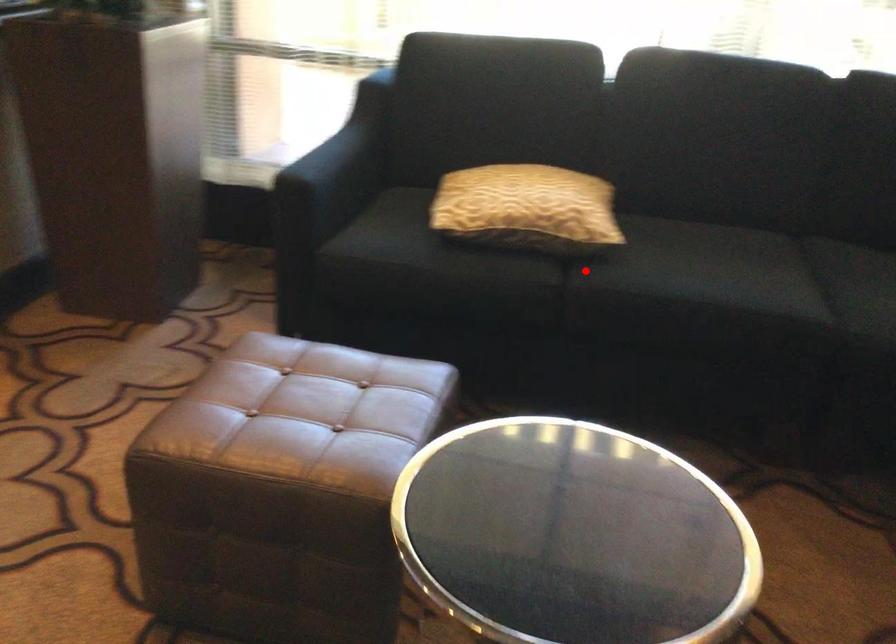
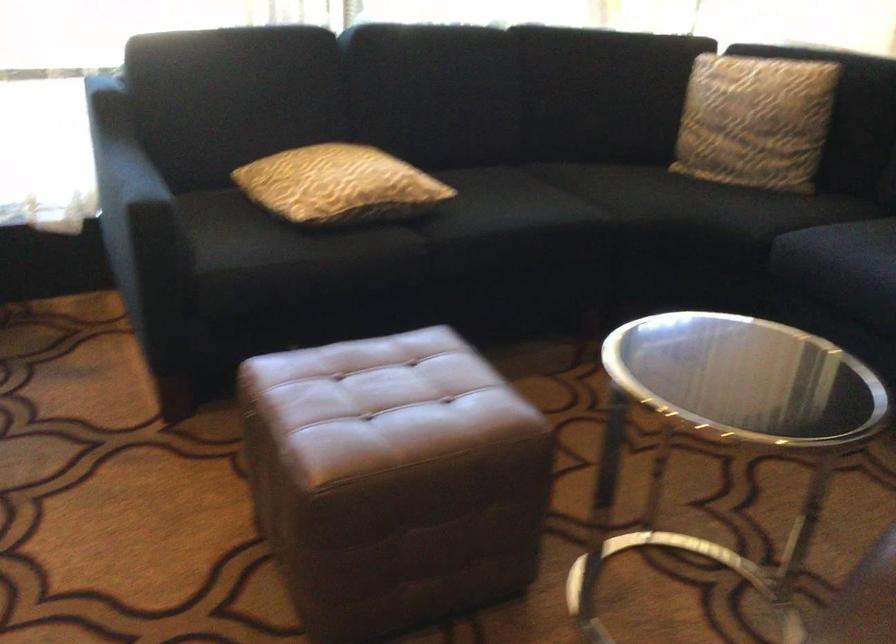
Find the pixel in the second image that matches the highlighted location in the first image.

(426, 227)